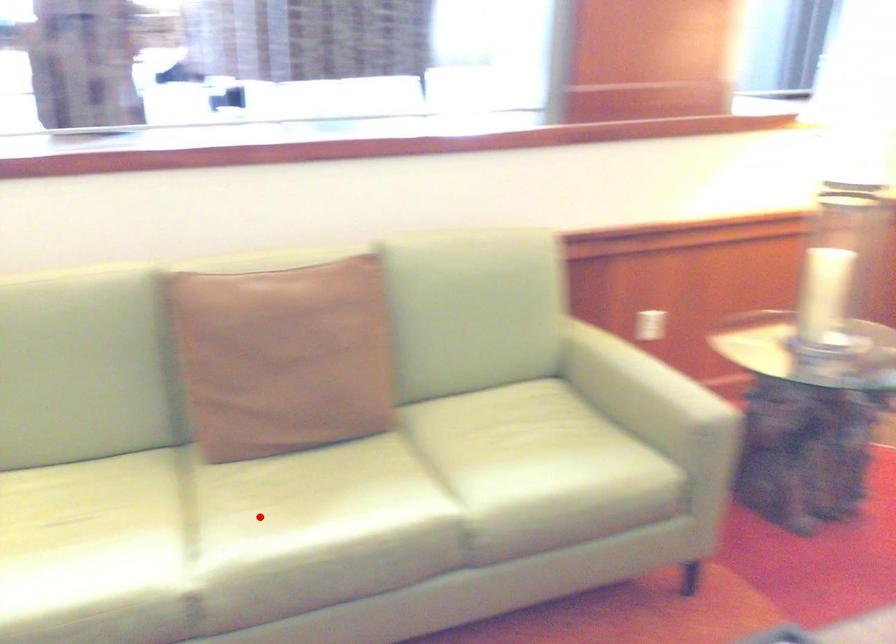
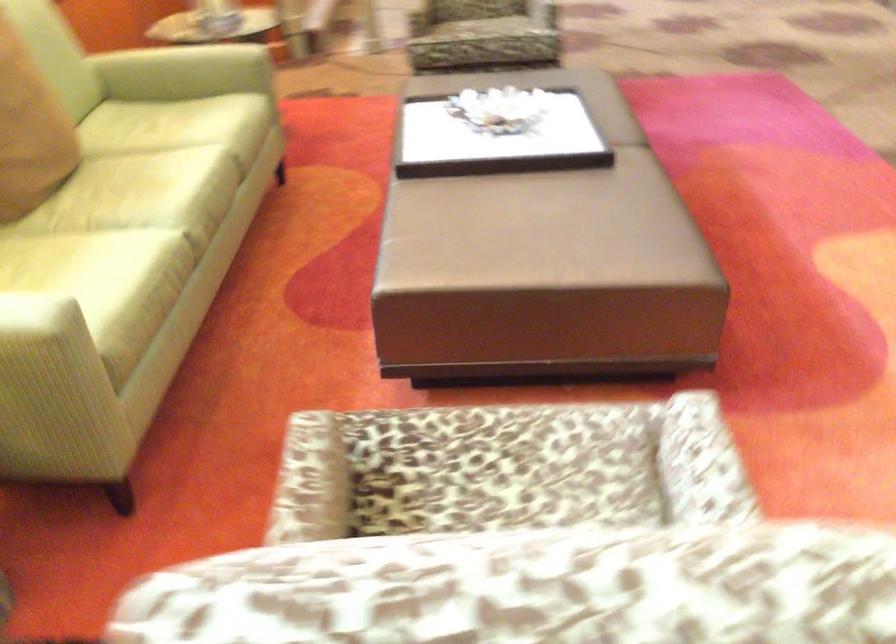
Find the pixel in the second image that matches the highlighted location in the first image.

(136, 199)